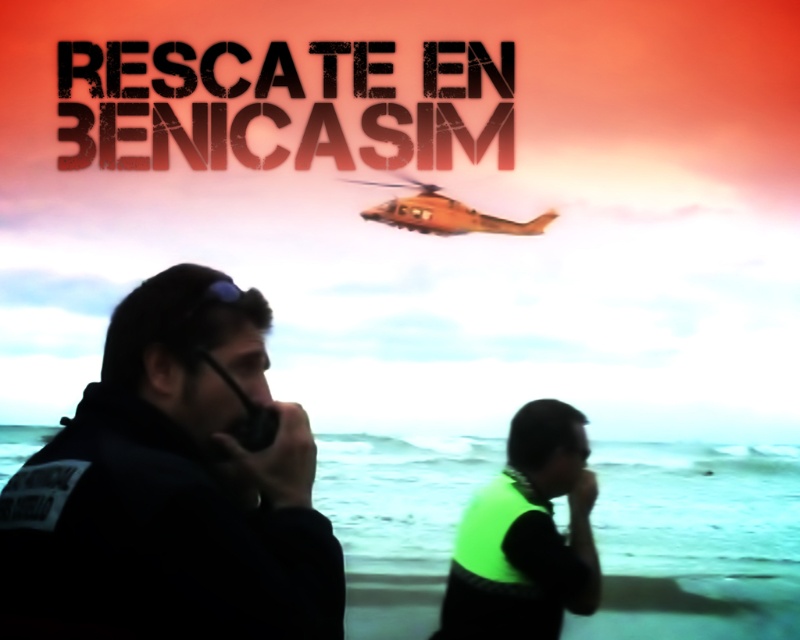
You are a rescue team member assessing the scene. You notice the black fabric uniform at left and the neon green vest at center. Which object occupies more horizontal space in the image?

The black fabric uniform at left might be wider than the neon green vest at center according to the description.

You are a rescue team member looking at the scene. Where is the black fabric uniform at left located in the image?

The black fabric uniform at left is located at point (172, 486) in the image.

In the scene shown: You are a rescue team member on the beach during a rescue operation. You see the black fabric uniform at left and the orange matte helicopter at upper center. Can you safely walk between them without getting too close to the helicopter?

The black fabric uniform at left and orange matte helicopter at upper center are 7.18 feet apart. Since the minimum safe distance from a helicopter is typically around 50 feet, you can safely walk between them as the distance is well within the safe range.